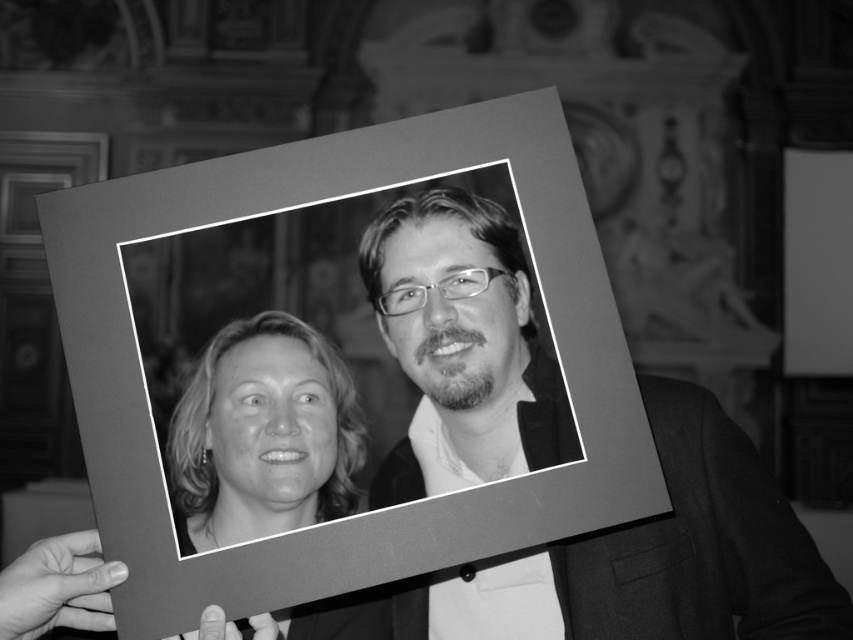
Question: Which of the following is the farthest from the observer?

Choices:
 (A) (248, 326)
 (B) (451, 547)

Answer: (A)

Question: Considering the relative positions of matte gray picture frame at center and smooth blonde hair at center in the image provided, where is matte gray picture frame at center located with respect to smooth blonde hair at center?

Choices:
 (A) below
 (B) above

Answer: (B)

Question: Observing the image, what is the correct spatial positioning of matte gray picture frame at center in reference to smooth blonde hair at center?

Choices:
 (A) left
 (B) right

Answer: (B)

Question: Which of the following is the farthest from the observer?

Choices:
 (A) matte gray picture frame at center
 (B) smooth blonde hair at center

Answer: (B)

Question: Can you confirm if matte gray picture frame at center is bigger than smooth blonde hair at center?

Choices:
 (A) no
 (B) yes

Answer: (B)